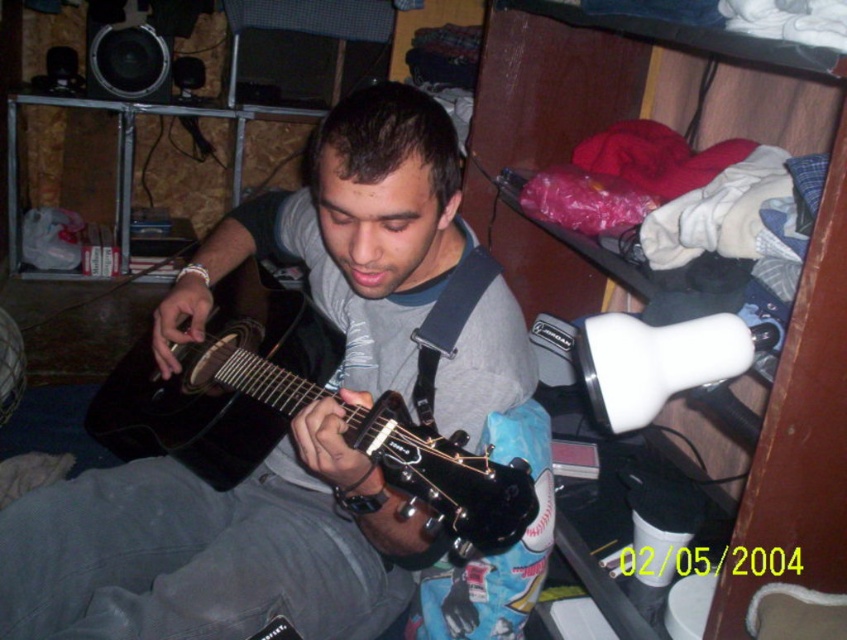
You are a photographer setting up for a session and need to choose between two guitars. You have a matte black guitar at center and a matte black acoustic guitar at center. Which one should you choose if you want the larger one for the photo?

The matte black guitar at center is bigger than the matte black acoustic guitar at center, so you should choose the matte black guitar at center for the photo.

You are a photographer setting up for a session. You have the matte black guitar at center and the white plastic lamp at upper right in your viewfinder. Which object is closer to the left edge of your frame?

The matte black guitar at center is positioned on the left side of the white plastic lamp at upper right, so it is closer to the left edge of the frame.

You are setting up a photography session in the room. You need to place a camera on a tripod that requires at least 1 meter of space between the white plastic lamp at upper right and the matte black acoustic guitar at center to avoid blocking the shot. Can the camera be positioned between them?

The white plastic lamp at upper right is narrower than the matte black acoustic guitar at center, but the description does not provide the exact distance between them. Therefore, it is unclear if there is enough space for the camera setup.